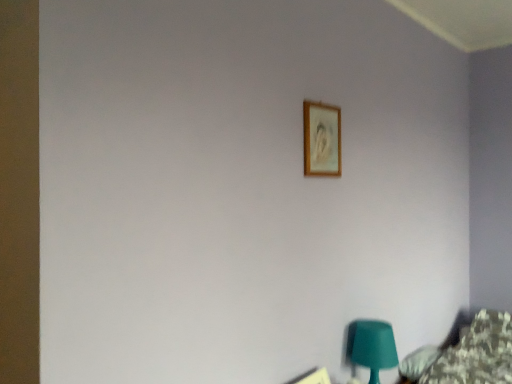
In the scene shown: Measure the distance between point (327, 116) and camera.

The depth of point (327, 116) is 1.69 meters.

What do you see at coordinates (371, 347) in the screenshot? The width and height of the screenshot is (512, 384). I see `matte green plastic table lamp at lower right` at bounding box center [371, 347].

Identify the location of wooden picture frame at upper center, arranged as the 2th picture frame when viewed from the top. (312, 377).

Is wooden frame at upper center, the second picture frame in the bottom-to-top sequence, with matte green plastic table lamp at lower right?

No, wooden frame at upper center, the second picture frame in the bottom-to-top sequence, is not next to matte green plastic table lamp at lower right.

Does wooden frame at upper center, the second picture frame in the bottom-to-top sequence, appear on the left side of matte green plastic table lamp at lower right?

Correct, you'll find wooden frame at upper center, the second picture frame in the bottom-to-top sequence, to the left of matte green plastic table lamp at lower right.

Considering the relative sizes of wooden frame at upper center, the 1th picture frame positioned from the top, and matte green plastic table lamp at lower right in the image provided, is wooden frame at upper center, the 1th picture frame positioned from the top, shorter than matte green plastic table lamp at lower right?

Yes, wooden frame at upper center, the 1th picture frame positioned from the top, is shorter than matte green plastic table lamp at lower right.

Between matte green plastic table lamp at lower right and wooden frame at upper center, the second picture frame in the bottom-to-top sequence, which one is positioned behind?

matte green plastic table lamp at lower right is further away from the camera.

Which object is positioned more to the right, matte green plastic table lamp at lower right or wooden frame at upper center, the second picture frame in the bottom-to-top sequence?

matte green plastic table lamp at lower right.

Do you think matte green plastic table lamp at lower right is within wooden frame at upper center, the second picture frame in the bottom-to-top sequence, or outside of it?

matte green plastic table lamp at lower right cannot be found inside wooden frame at upper center, the second picture frame in the bottom-to-top sequence.

This screenshot has height=384, width=512. Find the location of `table lamp behind the wooden frame at upper center, the second picture frame in the bottom-to-top sequence`. table lamp behind the wooden frame at upper center, the second picture frame in the bottom-to-top sequence is located at coordinates (371, 347).

Is wooden frame at upper center, the second picture frame in the bottom-to-top sequence, to the right of wooden picture frame at upper center, arranged as the 2th picture frame when viewed from the top, from the viewer's perspective?

Yes.

Is wooden frame at upper center, the second picture frame in the bottom-to-top sequence, touching wooden picture frame at upper center, arranged as the 2th picture frame when viewed from the top?

There is a gap between wooden frame at upper center, the second picture frame in the bottom-to-top sequence, and wooden picture frame at upper center, arranged as the 2th picture frame when viewed from the top.

This screenshot has height=384, width=512. In order to click on picture frame positioned vertically above the wooden picture frame at upper center, which is the 1th picture frame in bottom-to-top order (from a real-world perspective) in this screenshot , I will do `click(322, 139)`.

In the scene shown: Are wooden picture frame at upper center, arranged as the 2th picture frame when viewed from the top, and wooden frame at upper center, the 1th picture frame positioned from the top, far apart?

wooden picture frame at upper center, arranged as the 2th picture frame when viewed from the top, is near wooden frame at upper center, the 1th picture frame positioned from the top, not far away.

Is wooden picture frame at upper center, which is the 1th picture frame in bottom-to-top order, oriented towards wooden frame at upper center, the second picture frame in the bottom-to-top sequence?

No, wooden picture frame at upper center, which is the 1th picture frame in bottom-to-top order, is not facing towards wooden frame at upper center, the second picture frame in the bottom-to-top sequence.

From the picture: Is wooden picture frame at upper center, arranged as the 2th picture frame when viewed from the top, outside of wooden frame at upper center, the second picture frame in the bottom-to-top sequence?

wooden picture frame at upper center, arranged as the 2th picture frame when viewed from the top, is positioned outside wooden frame at upper center, the second picture frame in the bottom-to-top sequence.

Is wooden picture frame at upper center, arranged as the 2th picture frame when viewed from the top, further to the viewer compared to wooden frame at upper center, the second picture frame in the bottom-to-top sequence?

No, it is in front of wooden frame at upper center, the second picture frame in the bottom-to-top sequence.

Does point (289, 382) appear closer or farther from the camera than point (349, 347)?

Point (289, 382) appears to be closer to the viewer than point (349, 347).

Which is behind, wooden picture frame at upper center, arranged as the 2th picture frame when viewed from the top, or matte green plastic table lamp at lower right?

matte green plastic table lamp at lower right.

Are wooden picture frame at upper center, which is the 1th picture frame in bottom-to-top order, and matte green plastic table lamp at lower right located far from each other?

wooden picture frame at upper center, which is the 1th picture frame in bottom-to-top order, is actually quite close to matte green plastic table lamp at lower right.

From the image's perspective, who appears lower, wooden picture frame at upper center, arranged as the 2th picture frame when viewed from the top, or matte green plastic table lamp at lower right?

wooden picture frame at upper center, arranged as the 2th picture frame when viewed from the top.

What are the coordinates of `the 2nd picture frame in front of the matte green plastic table lamp at lower right` in the screenshot? It's located at (312, 377).

Would you say matte green plastic table lamp at lower right is inside or outside wooden picture frame at upper center, arranged as the 2th picture frame when viewed from the top?

matte green plastic table lamp at lower right exists outside the volume of wooden picture frame at upper center, arranged as the 2th picture frame when viewed from the top.

In terms of height, does matte green plastic table lamp at lower right look taller or shorter compared to wooden picture frame at upper center, which is the 1th picture frame in bottom-to-top order?

Considering their sizes, matte green plastic table lamp at lower right has more height than wooden picture frame at upper center, which is the 1th picture frame in bottom-to-top order.

Locate an element on the screen. This screenshot has width=512, height=384. table lamp behind the wooden frame at upper center, the second picture frame in the bottom-to-top sequence is located at coordinates (371, 347).

Find the location of a particular element. This screenshot has height=384, width=512. table lamp below the wooden frame at upper center, the second picture frame in the bottom-to-top sequence (from the image's perspective) is located at coordinates (371, 347).

Looking at this image, based on their spatial positions, is wooden frame at upper center, the 1th picture frame positioned from the top, or matte green plastic table lamp at lower right further from wooden picture frame at upper center, which is the 1th picture frame in bottom-to-top order?

The object further to wooden picture frame at upper center, which is the 1th picture frame in bottom-to-top order, is wooden frame at upper center, the 1th picture frame positioned from the top.

Which object lies nearer to the anchor point matte green plastic table lamp at lower right, wooden picture frame at upper center, which is the 1th picture frame in bottom-to-top order, or wooden frame at upper center, the 1th picture frame positioned from the top?

wooden picture frame at upper center, which is the 1th picture frame in bottom-to-top order, is closer to matte green plastic table lamp at lower right.

Which object lies further to the anchor point matte green plastic table lamp at lower right, wooden frame at upper center, the second picture frame in the bottom-to-top sequence, or wooden picture frame at upper center, which is the 1th picture frame in bottom-to-top order?

wooden frame at upper center, the second picture frame in the bottom-to-top sequence, is positioned further to the anchor matte green plastic table lamp at lower right.

Considering their positions, is matte green plastic table lamp at lower right positioned further to wooden frame at upper center, the second picture frame in the bottom-to-top sequence, than wooden picture frame at upper center, which is the 1th picture frame in bottom-to-top order?

The object further to wooden frame at upper center, the second picture frame in the bottom-to-top sequence, is wooden picture frame at upper center, which is the 1th picture frame in bottom-to-top order.

Based on their spatial positions, is wooden picture frame at upper center, which is the 1th picture frame in bottom-to-top order, or matte green plastic table lamp at lower right closer to wooden frame at upper center, the 1th picture frame positioned from the top?

Based on the image, matte green plastic table lamp at lower right appears to be nearer to wooden frame at upper center, the 1th picture frame positioned from the top.

From the image, which object appears to be nearer to wooden picture frame at upper center, which is the 1th picture frame in bottom-to-top order, matte green plastic table lamp at lower right or wooden frame at upper center, the second picture frame in the bottom-to-top sequence?

matte green plastic table lamp at lower right.

In order to click on table lamp between wooden frame at upper center, the 1th picture frame positioned from the top, and wooden picture frame at upper center, arranged as the 2th picture frame when viewed from the top, from top to bottom in this screenshot , I will do `click(371, 347)`.